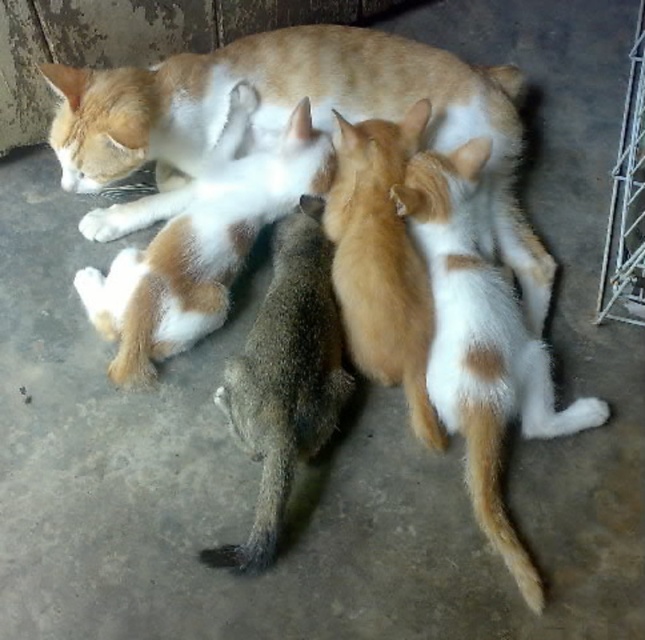
Describe the element at coordinates (201, 252) in the screenshot. I see `orange and white fur cat at upper left` at that location.

Does orange and white fur cat at upper left appear under fluffy orange kitten at center?

Actually, orange and white fur cat at upper left is above fluffy orange kitten at center.

Is point (239, 218) positioned in front of point (408, 252)?

That is False.

Where is `orange and white fur cat at upper left`? The height and width of the screenshot is (640, 645). orange and white fur cat at upper left is located at coordinates (201, 252).

Which of these two, orange-white fur cat at center or metallic silver cage at right, stands taller?

Standing taller between the two is metallic silver cage at right.

Is orange-white fur cat at center to the right of metallic silver cage at right from the viewer's perspective?

In fact, orange-white fur cat at center is to the left of metallic silver cage at right.

Is point (513, 541) positioned after point (628, 141)?

That is False.

Where is `orange-white fur cat at center`? orange-white fur cat at center is located at coordinates (481, 348).

Can you confirm if orange-white fur cat at center is shorter than fluffy orange kitten at center?

No, orange-white fur cat at center is not shorter than fluffy orange kitten at center.

Can you confirm if orange-white fur cat at center is positioned to the left of fluffy orange kitten at center?

No, orange-white fur cat at center is not to the left of fluffy orange kitten at center.

Between point (546, 372) and point (350, 138), which one is positioned in front?

Point (546, 372) is more forward.

Find the location of a particular element. The width and height of the screenshot is (645, 640). orange-white fur cat at center is located at coordinates (481, 348).